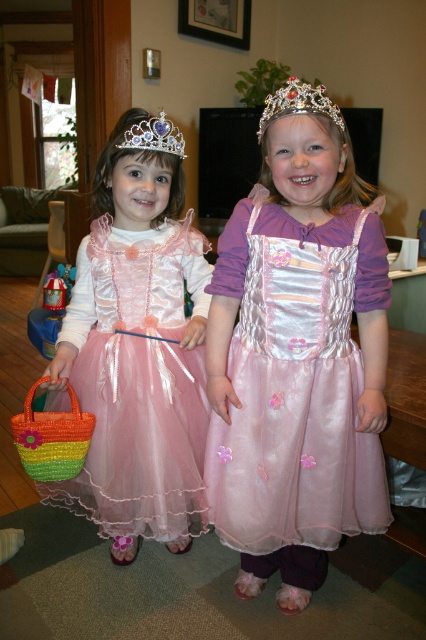
Does pink tulle dress at left have a lesser width compared to silver metallic crown at upper center?

No, pink tulle dress at left is not thinner than silver metallic crown at upper center.

Can you confirm if pink tulle dress at left is taller than silver metallic crown at upper center?

Yes, pink tulle dress at left is taller than silver metallic crown at upper center.

Locate an element on the screen. This screenshot has width=426, height=640. pink tulle dress at left is located at coordinates (138, 381).

Is pink tulle dress at left wider than silver/crystal tiara at upper center?

Indeed, pink tulle dress at left has a greater width compared to silver/crystal tiara at upper center.

Is pink tulle dress at left taller than silver/crystal tiara at upper center?

Indeed, pink tulle dress at left has a greater height compared to silver/crystal tiara at upper center.

Who is more forward, (92, 282) or (291, 77)?

Positioned in front is point (291, 77).

Where is `pink tulle dress at left`? The width and height of the screenshot is (426, 640). pink tulle dress at left is located at coordinates [138, 381].

Locate an element on the screen. This screenshot has width=426, height=640. pink satin dress at center is located at coordinates (294, 387).

Is pink satin dress at center above pink tulle dress at left?

Yes.

Is point (271, 308) closer to viewer compared to point (149, 404)?

Yes, point (271, 308) is closer to viewer.

Where is `pink satin dress at center`? pink satin dress at center is located at coordinates (294, 387).